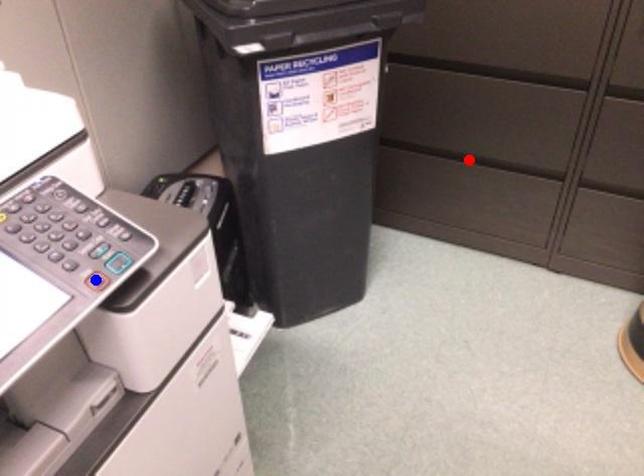
Question: In the image, two points are highlighted. Which point is nearer to the camera? Reply with the corresponding letter.

Choices:
 (A) blue point
 (B) red point

Answer: (A)